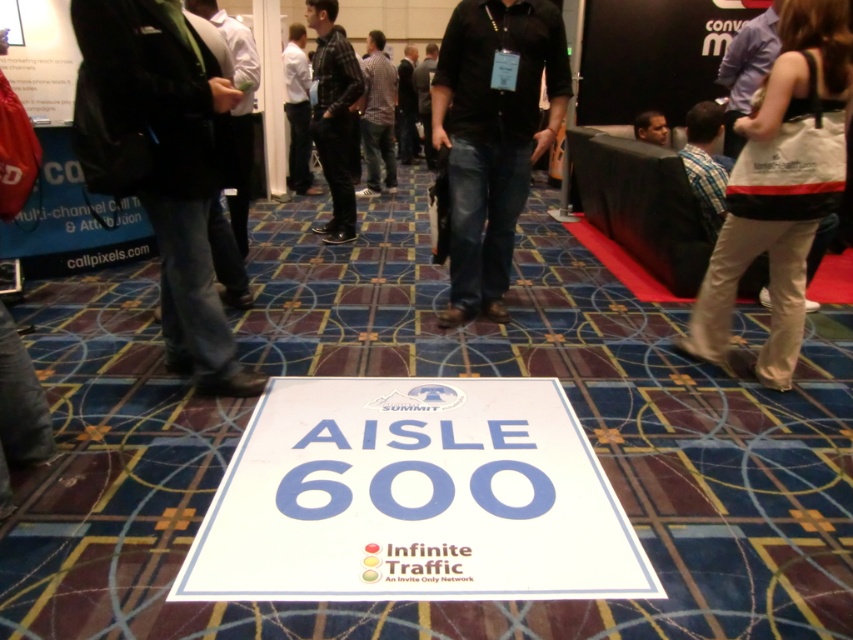
Question: Which of these objects is positioned closest to the plaid shirt at center?

Choices:
 (A) black leather jacket at center
 (B) white shirt at upper center
 (C) dark gray sweater at center
 (D) dark brown hair at upper center

Answer: (B)

Question: Is black leather jacket at left wider than white shirt at upper center?

Choices:
 (A) yes
 (B) no

Answer: (A)

Question: Which is farther from the dark brown hair at upper center?

Choices:
 (A) white shirt at upper center
 (B) black leather jacket at center

Answer: (A)

Question: Can you confirm if white paper sign at center is positioned to the right of black leather jacket at center?

Choices:
 (A) yes
 (B) no

Answer: (A)

Question: Which object is farther from the camera taking this photo?

Choices:
 (A) white shirt at upper center
 (B) black denim jeans at center
 (C) black leather jacket at center

Answer: (A)

Question: Is white fabric bag at center-right positioned before black denim jeans at center?

Choices:
 (A) no
 (B) yes

Answer: (B)